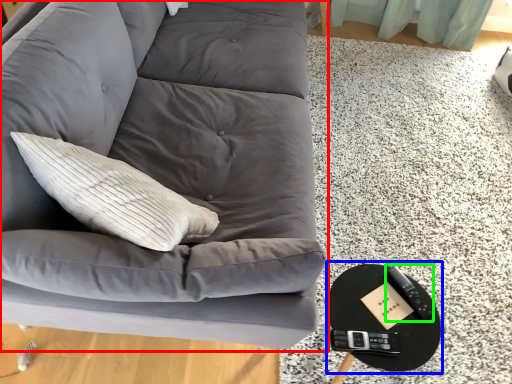
Question: Based on their relative distances, which object is farther from studio couch (highlighted by a red box)? Choose from round table (highlighted by a blue box) and remote (highlighted by a green box).

Choices:
 (A) round table
 (B) remote

Answer: (B)